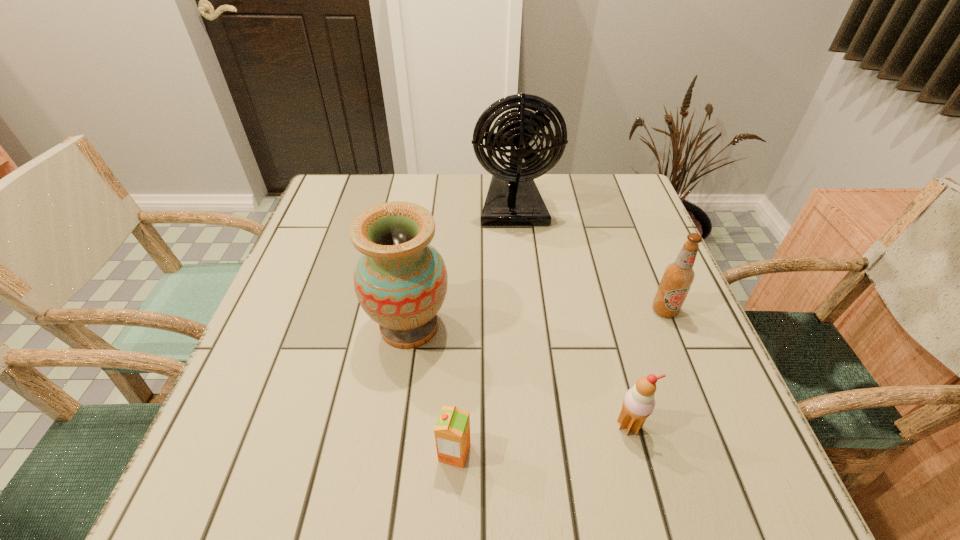
Locate an element on the screen. vacant space located on the front label of the beer bottle is located at coordinates (678, 343).

Find the location of a particular element. The height and width of the screenshot is (540, 960). free space located 0.050m at the front with a straw on the fourth object from left to right is located at coordinates (640, 468).

This screenshot has width=960, height=540. I want to click on vacant space located 0.330m on the back of the shortest object, so click(461, 297).

Where is `object at the far edge`? object at the far edge is located at coordinates (513, 199).

Locate an element on the screen. Image resolution: width=960 pixels, height=540 pixels. object positioned at the near edge is located at coordinates (452, 431).

Where is `object positioned at the right edge`? The image size is (960, 540). object positioned at the right edge is located at coordinates (678, 277).

The width and height of the screenshot is (960, 540). Identify the location of vacant space at the far edge of the desktop. (549, 207).

Image resolution: width=960 pixels, height=540 pixels. Identify the location of vacant space at the near edge of the desktop. (304, 475).

Identify the location of blank space at the left edge of the desktop. This screenshot has height=540, width=960. (246, 428).

I want to click on free region at the right edge of the desktop, so click(626, 258).